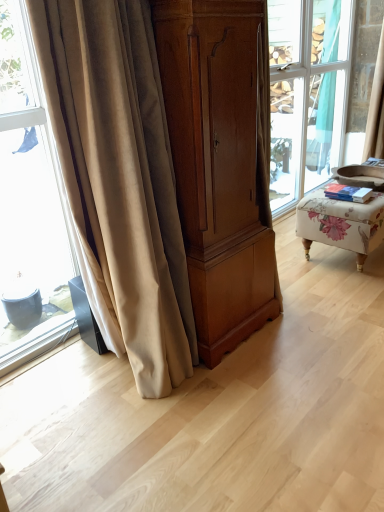
Identify the location of free space to the left of beige velvet curtain at left, which is the 2th curtain in top-to-bottom order. [x=56, y=388].